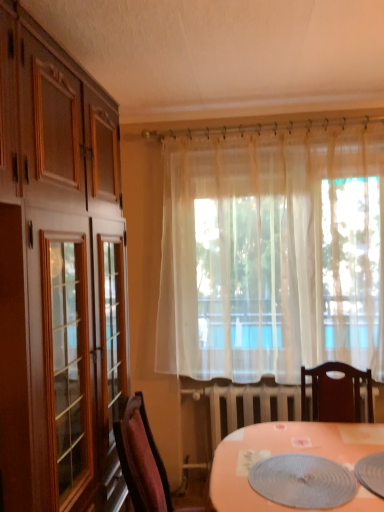
Question: Is sheer white curtain at center at the right side of velvet burgundy chair at lower left?

Choices:
 (A) no
 (B) yes

Answer: (B)

Question: From the image's perspective, is sheer white curtain at center below velvet burgundy chair at lower left?

Choices:
 (A) yes
 (B) no

Answer: (B)

Question: Is sheer white curtain at center bigger than velvet burgundy chair at lower left?

Choices:
 (A) no
 (B) yes

Answer: (B)

Question: Is velvet burgundy chair at lower left at the back of sheer white curtain at center?

Choices:
 (A) yes
 (B) no

Answer: (B)

Question: Is sheer white curtain at center at the left side of velvet burgundy chair at lower left?

Choices:
 (A) no
 (B) yes

Answer: (A)

Question: Considering the positions of point (311, 348) and point (137, 403), is point (311, 348) closer or farther from the camera than point (137, 403)?

Choices:
 (A) farther
 (B) closer

Answer: (A)

Question: From the image's perspective, is sheer white curtain at center positioned above or below velvet burgundy chair at lower left?

Choices:
 (A) below
 (B) above

Answer: (B)

Question: Would you say sheer white curtain at center is to the left or to the right of velvet burgundy chair at lower left in the picture?

Choices:
 (A) right
 (B) left

Answer: (A)

Question: Do you think sheer white curtain at center is within velvet burgundy chair at lower left, or outside of it?

Choices:
 (A) inside
 (B) outside

Answer: (B)

Question: Looking at their shapes, would you say textured gray placemat at lower center is wider or thinner than velvet burgundy chair at lower left?

Choices:
 (A) wide
 (B) thin

Answer: (B)

Question: Is textured gray placemat at lower center in front of or behind velvet burgundy chair at lower left in the image?

Choices:
 (A) front
 (B) behind

Answer: (A)

Question: Considering the positions of point (264, 480) and point (152, 497), is point (264, 480) closer or farther from the camera than point (152, 497)?

Choices:
 (A) closer
 (B) farther

Answer: (A)

Question: In terms of height, does textured gray placemat at lower center look taller or shorter compared to velvet burgundy chair at lower left?

Choices:
 (A) tall
 (B) short

Answer: (B)

Question: From the image's perspective, is velvet burgundy chair at lower left positioned above or below textured gray placemat at lower center?

Choices:
 (A) below
 (B) above

Answer: (A)

Question: Considering the positions of velvet burgundy chair at lower left and textured gray placemat at lower center in the image, is velvet burgundy chair at lower left taller or shorter than textured gray placemat at lower center?

Choices:
 (A) tall
 (B) short

Answer: (A)